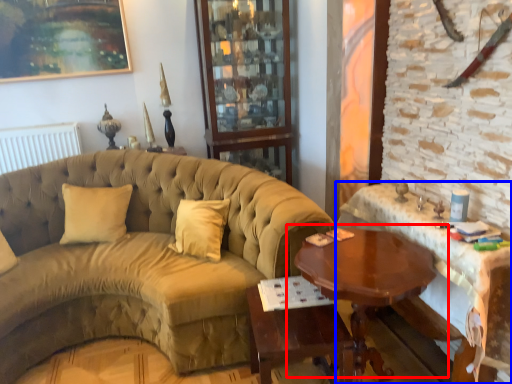
Question: Which object is further to the camera taking this photo, table (highlighted by a red box) or table (highlighted by a blue box)?

Choices:
 (A) table
 (B) table

Answer: (A)